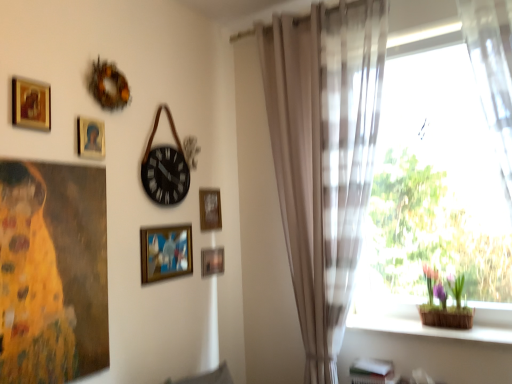
Identify the location of vacant area situated below translucent fabric at right (from a real-world perspective). The width and height of the screenshot is (512, 384). (415, 330).